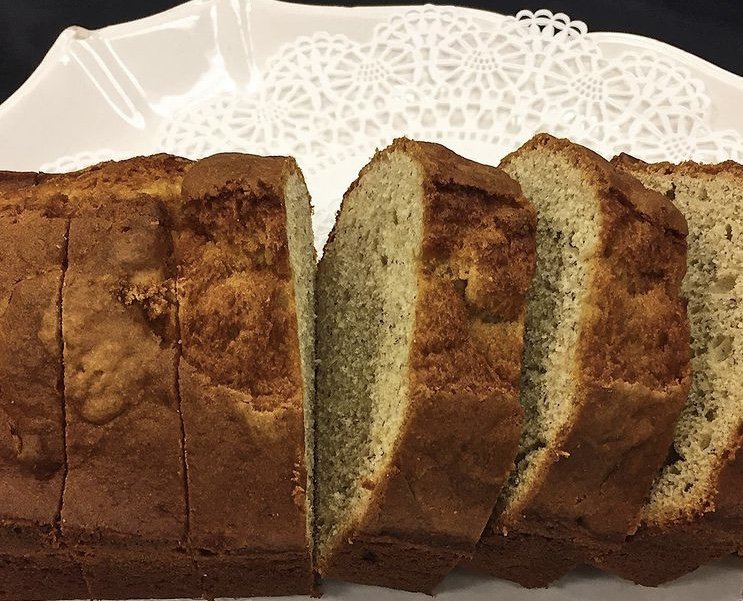
Find the location of a particular element. This screenshot has width=743, height=601. plate design is located at coordinates (129, 87), (236, 38).